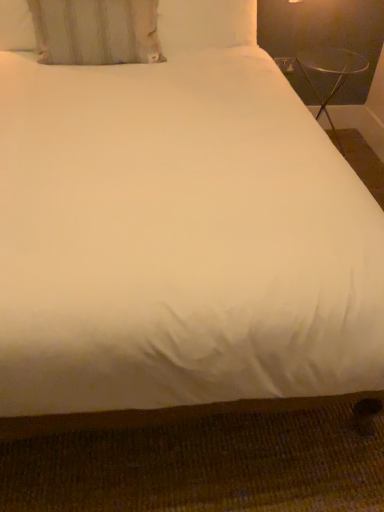
Question: Is white fabric pillow at upper left looking in the opposite direction of transparent glass table at upper right?

Choices:
 (A) yes
 (B) no

Answer: (B)

Question: From the image's perspective, is white fabric pillow at upper left below transparent glass table at upper right?

Choices:
 (A) no
 (B) yes

Answer: (A)

Question: From a real-world perspective, is white fabric pillow at upper left below transparent glass table at upper right?

Choices:
 (A) no
 (B) yes

Answer: (A)

Question: Does white fabric pillow at upper left have a greater height compared to transparent glass table at upper right?

Choices:
 (A) no
 (B) yes

Answer: (A)

Question: Is white fabric pillow at upper left positioned beyond the bounds of transparent glass table at upper right?

Choices:
 (A) yes
 (B) no

Answer: (A)

Question: Is white fabric pillow at upper left facing towards transparent glass table at upper right?

Choices:
 (A) yes
 (B) no

Answer: (B)

Question: Is transparent glass table at upper right at the right side of white fabric pillow at upper left?

Choices:
 (A) yes
 (B) no

Answer: (A)

Question: From the image's perspective, is transparent glass table at upper right above white fabric pillow at upper left?

Choices:
 (A) yes
 (B) no

Answer: (B)

Question: Would you say transparent glass table at upper right is a long distance from white fabric pillow at upper left?

Choices:
 (A) yes
 (B) no

Answer: (A)

Question: Is transparent glass table at upper right bigger than white fabric pillow at upper left?

Choices:
 (A) no
 (B) yes

Answer: (B)

Question: From a real-world perspective, is transparent glass table at upper right on top of white fabric pillow at upper left?

Choices:
 (A) no
 (B) yes

Answer: (A)

Question: Is transparent glass table at upper right next to white fabric pillow at upper left?

Choices:
 (A) no
 (B) yes

Answer: (A)

Question: Is transparent glass table at upper right wider or thinner than white fabric pillow at upper left?

Choices:
 (A) wide
 (B) thin

Answer: (A)